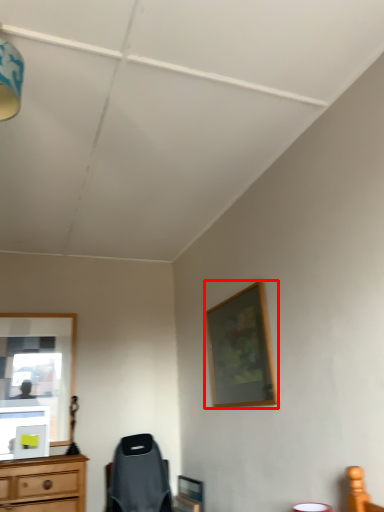
Question: Observing the image, what is the correct spatial positioning of picture frame (annotated by the red box) in reference to light fixture?

Choices:
 (A) left
 (B) right

Answer: (B)